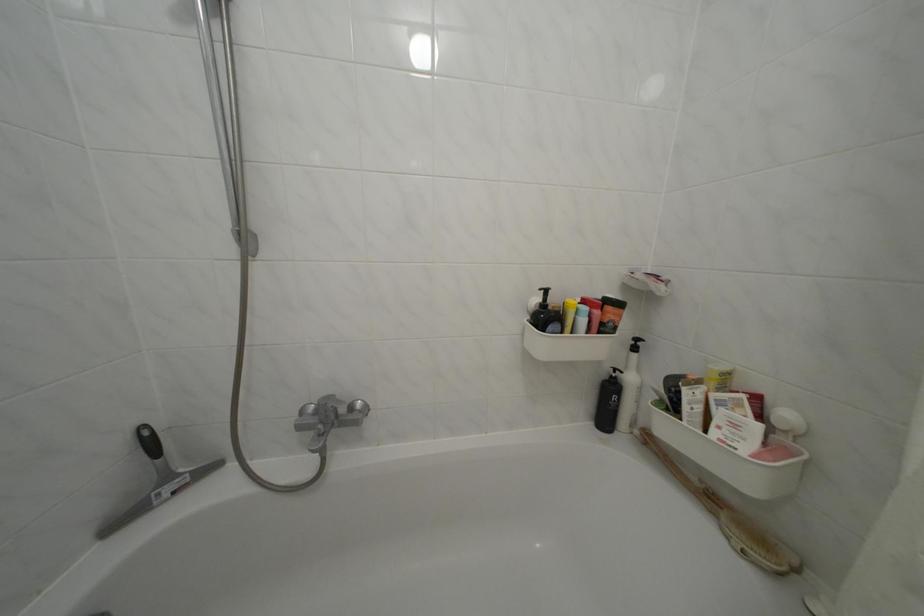
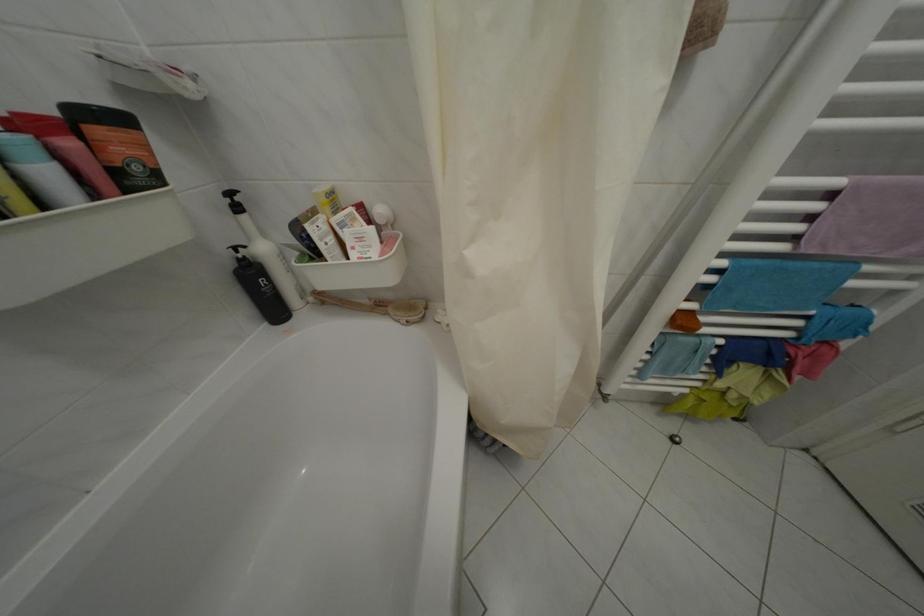
Locate, in the second image, the point that corresponds to (623,381) in the first image.

(249, 262)